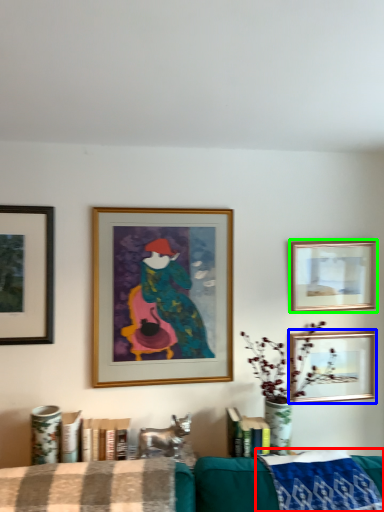
Question: Considering the real-world distances, which object is closest to cloth (highlighted by a red box)? picture frame (highlighted by a blue box) or picture frame (highlighted by a green box).

Choices:
 (A) picture frame
 (B) picture frame

Answer: (A)